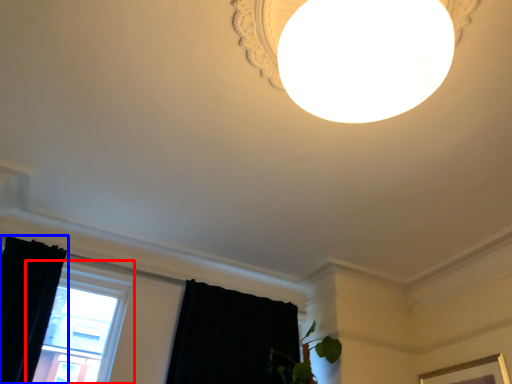
Question: Which of the following is the farthest to the observer, window (highlighted by a red box) or curtain (highlighted by a blue box)?

Choices:
 (A) window
 (B) curtain

Answer: (A)